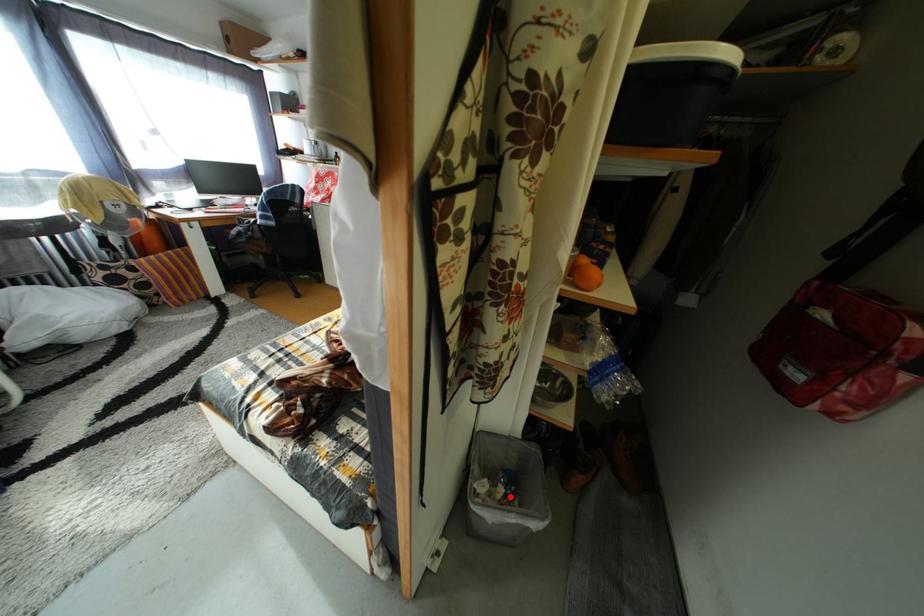
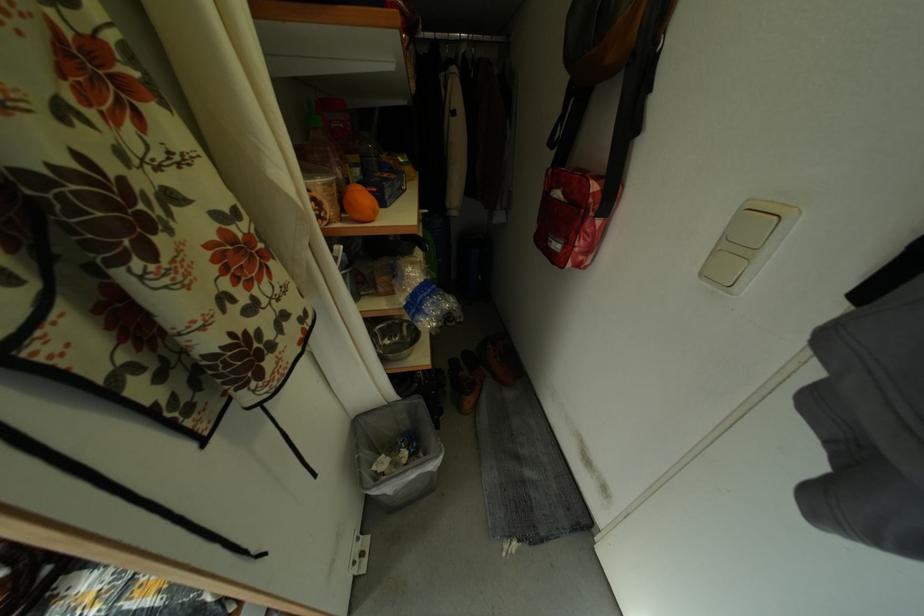
The point at the highlighted location is marked in the first image. Where is the corresponding point in the second image?

(414, 460)